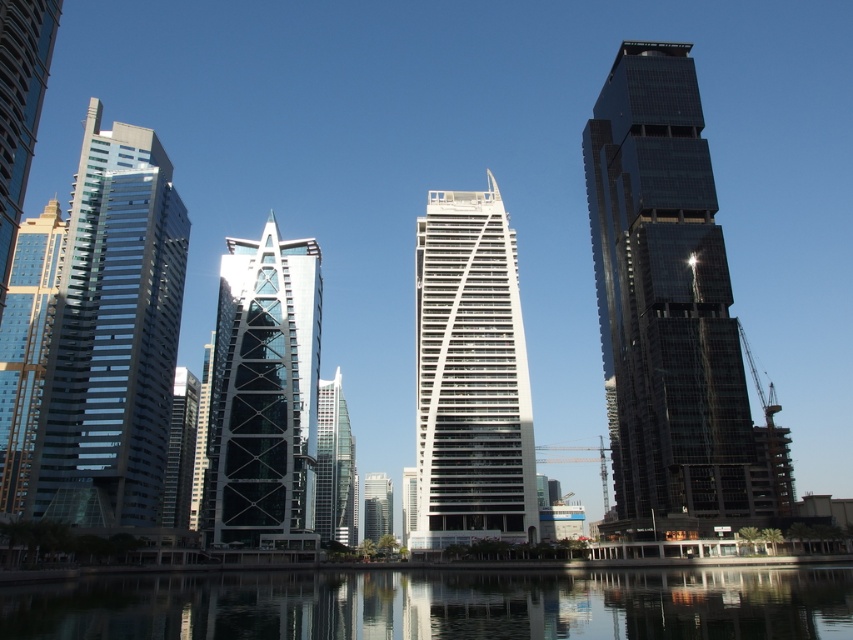
Which is more to the left, transparent glass water at center or white glass building at center?

From the viewer's perspective, white glass building at center appears more on the left side.

This screenshot has height=640, width=853. Identify the location of transparent glass water at center. (440, 604).

What do you see at coordinates (440, 604) in the screenshot? This screenshot has height=640, width=853. I see `transparent glass water at center` at bounding box center [440, 604].

I want to click on transparent glass water at center, so tap(440, 604).

Does dark glass skyscraper at center have a smaller size compared to transparent glass water at center?

Actually, dark glass skyscraper at center might be larger than transparent glass water at center.

Can you confirm if dark glass skyscraper at center is positioned below transparent glass water at center?

No.

Is point (769, 476) less distant than point (247, 634)?

That is False.

In order to click on dark glass skyscraper at center in this screenshot , I will do `click(670, 305)`.

Who is higher up, white glass building at center or glassy steel skyscraper at center?

white glass building at center

Locate an element on the screen. This screenshot has width=853, height=640. white glass building at center is located at coordinates (469, 376).

Where is `white glass building at center`? This screenshot has width=853, height=640. white glass building at center is located at coordinates (469, 376).

The image size is (853, 640). Find the location of `white glass building at center`. white glass building at center is located at coordinates (469, 376).